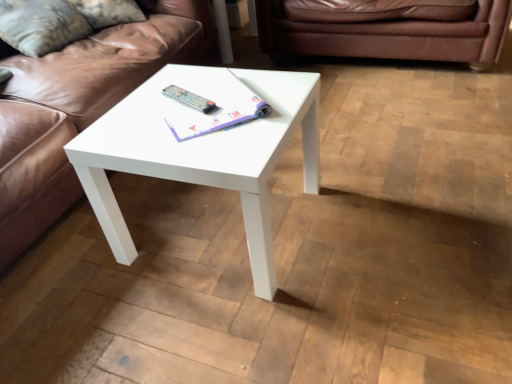
Find the location of a particular element. The image size is (512, 384). vacant space positioned to the left of white paper book at center is located at coordinates (128, 121).